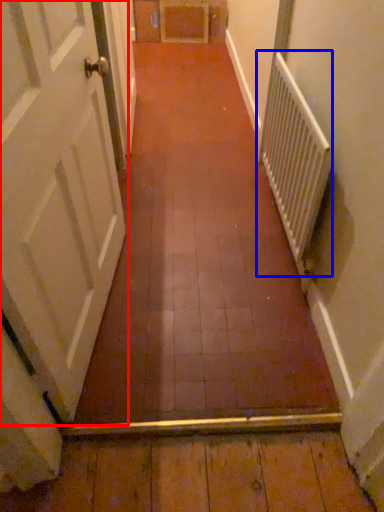
Question: Among these objects, which one is nearest to the camera, door (highlighted by a red box) or radiator (highlighted by a blue box)?

Choices:
 (A) door
 (B) radiator

Answer: (A)